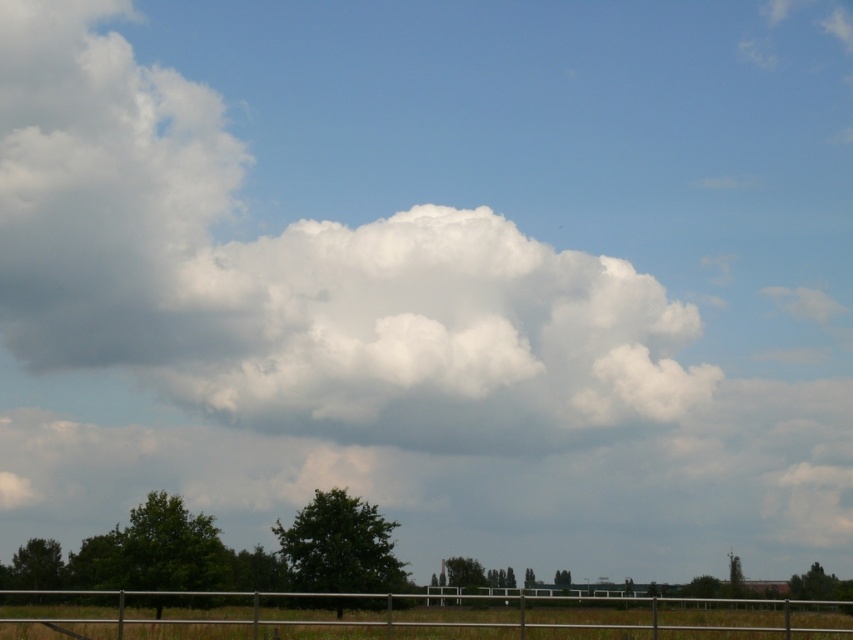
Question: Which point is closer to the camera?

Choices:
 (A) (228, 605)
 (B) (241, 344)

Answer: (A)

Question: Is white fluffy cloud at upper center positioned behind silver metallic fence at lower center?

Choices:
 (A) no
 (B) yes

Answer: (B)

Question: Which object appears farthest from the camera in this image?

Choices:
 (A) white fluffy cloud at upper center
 (B) silver metallic fence at lower center

Answer: (A)

Question: Does white fluffy cloud at upper center come in front of silver metallic fence at lower center?

Choices:
 (A) no
 (B) yes

Answer: (A)

Question: From the image, what is the correct spatial relationship of white fluffy cloud at upper center in relation to silver metallic fence at lower center?

Choices:
 (A) left
 (B) right

Answer: (A)